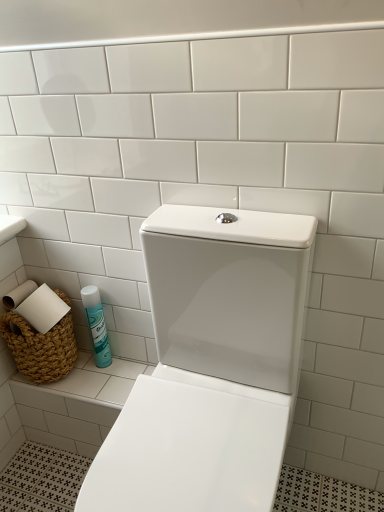
The width and height of the screenshot is (384, 512). What are the coordinates of `free location in front of blue glossy can at lower left` in the screenshot? It's located at (104, 383).